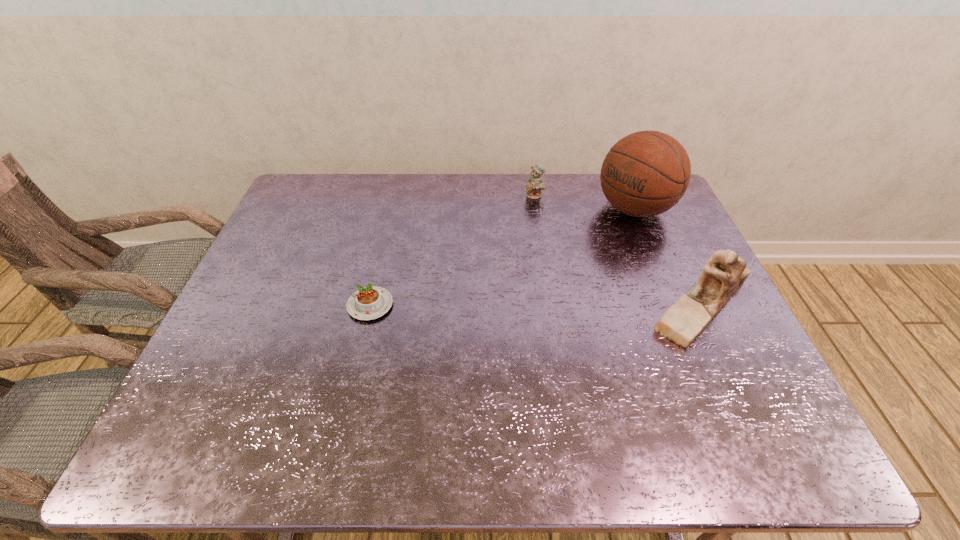
At what (x,y) coordinates should I click in order to perform the action: click on object that is at the far right corner. Please return your answer as a coordinate pair (x, y). Image resolution: width=960 pixels, height=540 pixels. Looking at the image, I should click on tap(646, 173).

Where is `free point at the far edge`? free point at the far edge is located at coordinates (492, 206).

In the image, there is a desktop. What are the coordinates of `vacant area at the near edge` in the screenshot? It's located at (318, 400).

This screenshot has height=540, width=960. In the image, there is a desktop. Identify the location of vacant area at the left edge. (260, 314).

Find the location of a particular element. The image size is (960, 540). vacant space at the right edge is located at coordinates (690, 264).

Locate an element on the screen. This screenshot has height=540, width=960. vacant space at the near left corner of the desktop is located at coordinates (250, 379).

Locate an element on the screen. vacant area that lies between the leftmost object and the third shortest object is located at coordinates (536, 305).

The width and height of the screenshot is (960, 540). What are the coordinates of `vacant space that is in between the pudding and the figurine` in the screenshot? It's located at (536, 305).

Find the location of `free point between the second object from left to right and the figurine`. free point between the second object from left to right and the figurine is located at coordinates (x=618, y=251).

Identify the location of free space between the pudding and the figurine. (536, 305).